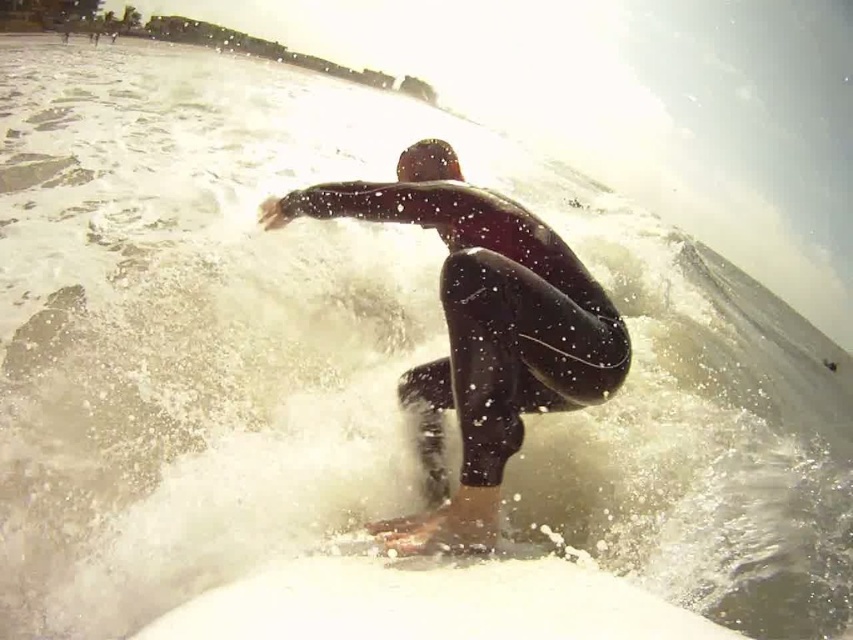
Does black wetsuit surfer at center have a greater width compared to white foam surfboard at center?

Yes, black wetsuit surfer at center is wider than white foam surfboard at center.

Is black wetsuit surfer at center positioned before white foam surfboard at center?

No, it is behind white foam surfboard at center.

What do you see at coordinates (482, 328) in the screenshot? This screenshot has width=853, height=640. I see `black wetsuit surfer at center` at bounding box center [482, 328].

The image size is (853, 640). Identify the location of black wetsuit surfer at center. (482, 328).